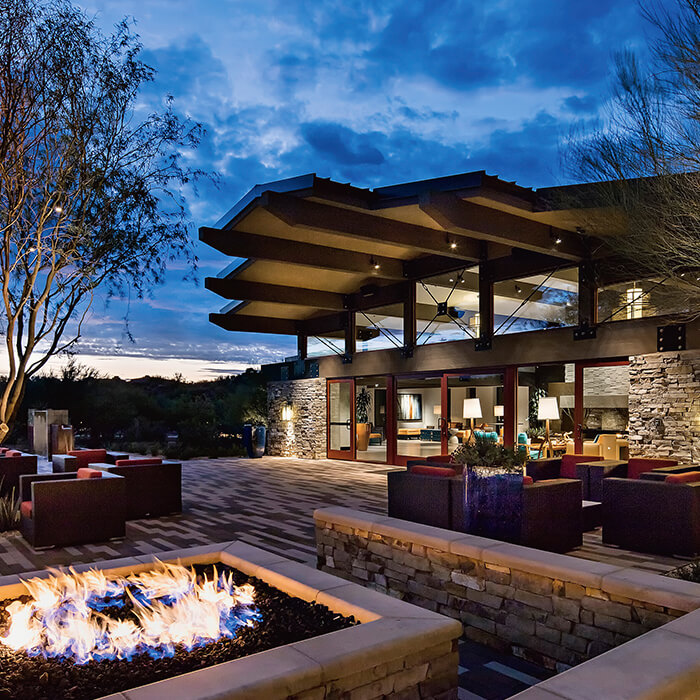
Locate an element on the screen. light is located at coordinates (288, 414).